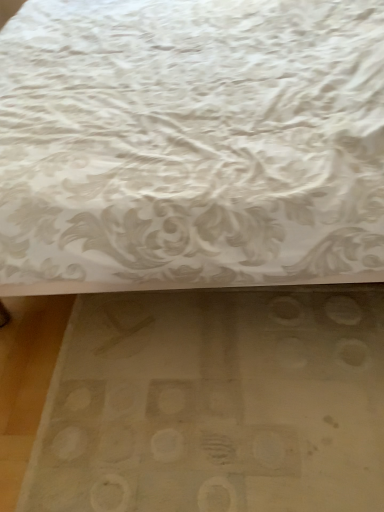
Question: Is the depth of white textured fabric at upper center less than that of white matte mat at lower center?

Choices:
 (A) yes
 (B) no

Answer: (A)

Question: Is white textured fabric at upper center facing towards white matte mat at lower center?

Choices:
 (A) no
 (B) yes

Answer: (A)

Question: Is white textured fabric at upper center at the left side of white matte mat at lower center?

Choices:
 (A) yes
 (B) no

Answer: (A)

Question: Are white textured fabric at upper center and white matte mat at lower center far apart?

Choices:
 (A) no
 (B) yes

Answer: (A)

Question: Is white textured fabric at upper center behind white matte mat at lower center?

Choices:
 (A) no
 (B) yes

Answer: (A)

Question: Is white textured fabric at upper center to the right of white matte mat at lower center from the viewer's perspective?

Choices:
 (A) yes
 (B) no

Answer: (B)

Question: Does white matte mat at lower center have a lesser height compared to white textured fabric at upper center?

Choices:
 (A) no
 (B) yes

Answer: (B)

Question: Can you confirm if white matte mat at lower center is thinner than white textured fabric at upper center?

Choices:
 (A) no
 (B) yes

Answer: (B)

Question: Can you confirm if white matte mat at lower center is positioned to the right of white textured fabric at upper center?

Choices:
 (A) no
 (B) yes

Answer: (B)

Question: From the image's perspective, would you say white matte mat at lower center is positioned over white textured fabric at upper center?

Choices:
 (A) yes
 (B) no

Answer: (B)

Question: Considering the relative positions of white matte mat at lower center and white textured fabric at upper center in the image provided, is white matte mat at lower center to the left of white textured fabric at upper center from the viewer's perspective?

Choices:
 (A) yes
 (B) no

Answer: (B)

Question: Is white matte mat at lower center further to camera compared to white textured fabric at upper center?

Choices:
 (A) yes
 (B) no

Answer: (A)

Question: From the image's perspective, is white textured fabric at upper center located above or below white matte mat at lower center?

Choices:
 (A) above
 (B) below

Answer: (A)